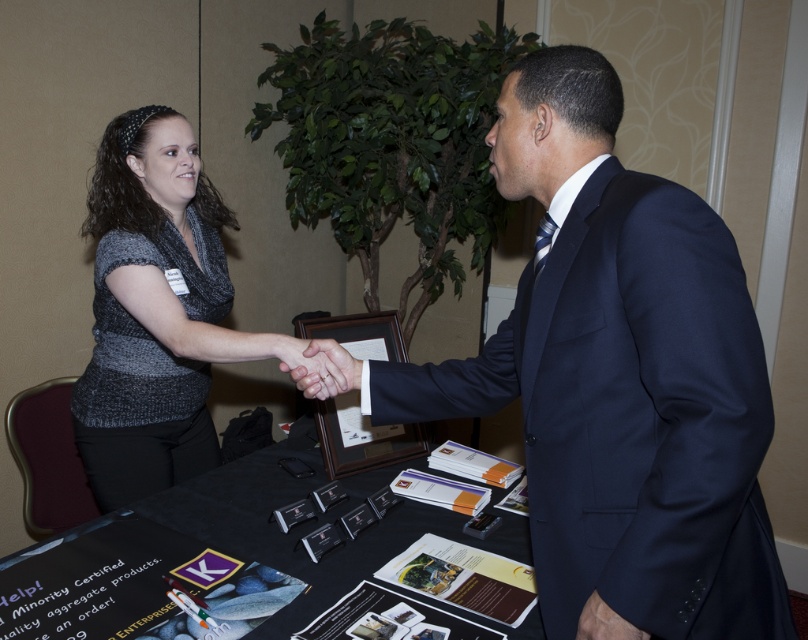
You are attending a networking event and notice two people interacting. The woman is on the left wearing a dark gray top, and the man is on the right wearing a knit sweater at center. Based on their positions, can you determine who is closer to the framed picture or certificate on the table?

The knit sweater at center is located at point (154,310), which places the man closer to the framed picture or certificate on the table compared to the woman on the left.

You are organizing a small event and need to place a name tag on the table between the knit sweater at center and the black paper at center. Since the name tag is rectangular and has a width of 10 cm, which object should you place it next to to ensure it fits without overlapping?

The knit sweater at center is larger in size than the black paper at center, so placing the name tag next to the black paper at center would leave more space for the name tag to fit without overlapping.